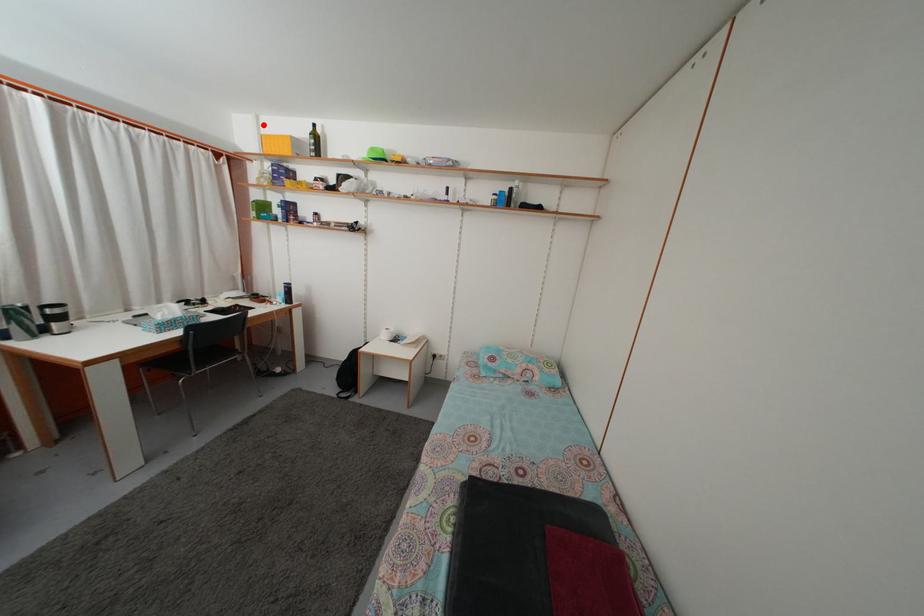
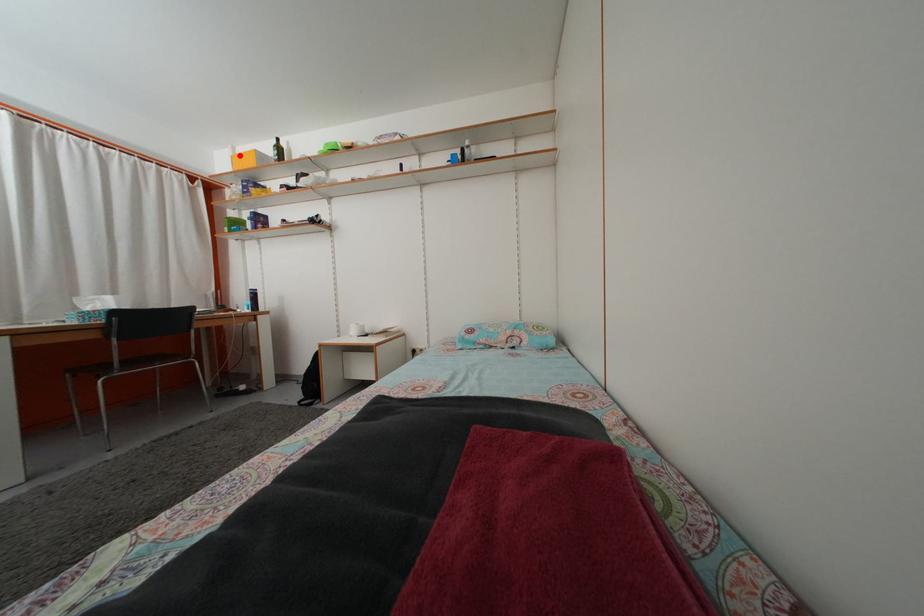
I am providing you with two images of the same scene from different viewpoints. A red point is marked on the first image and another point is marked on the second image. Does the point marked in image1 correspond to the same location as the one in image2?

Yes